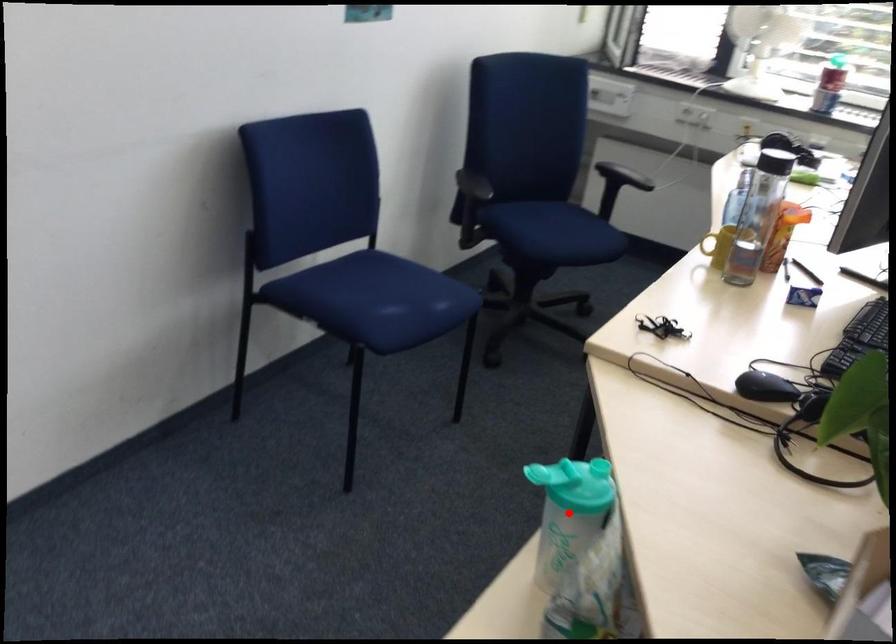
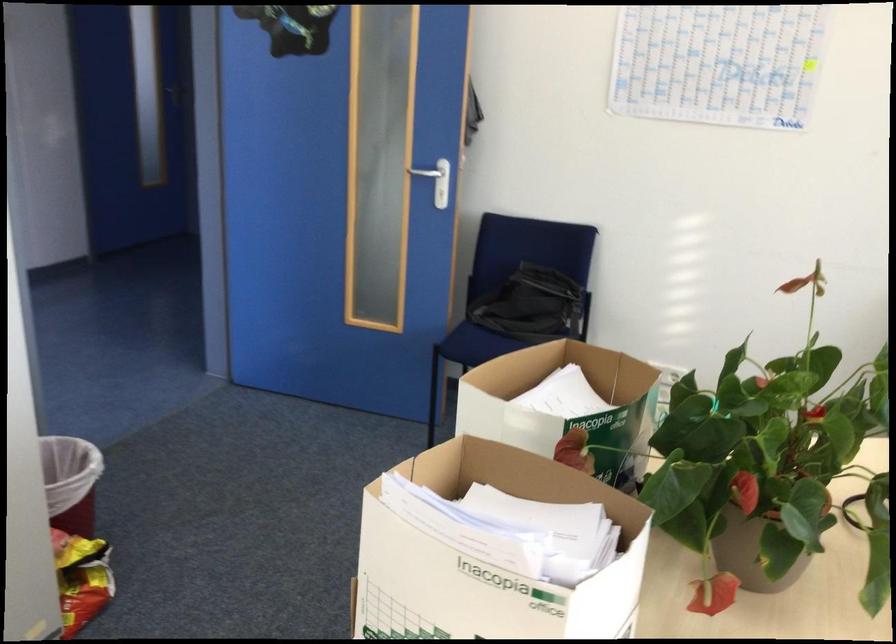
Question: I am providing you with two images of the same scene from different viewpoints. A red point is marked on the first image. At the location where the point appears in image 1, is it still visible in image 2?

Choices:
 (A) Yes
 (B) No

Answer: (B)